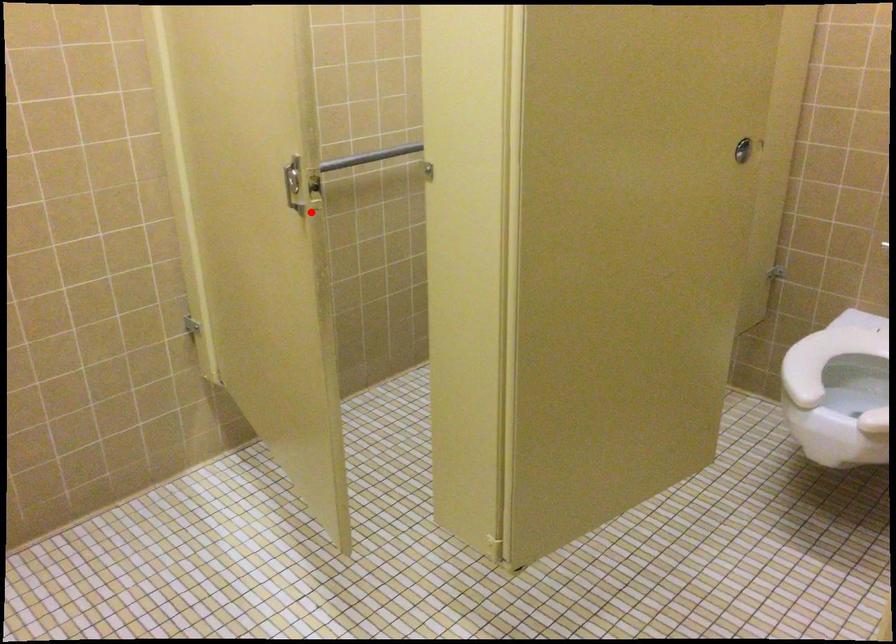
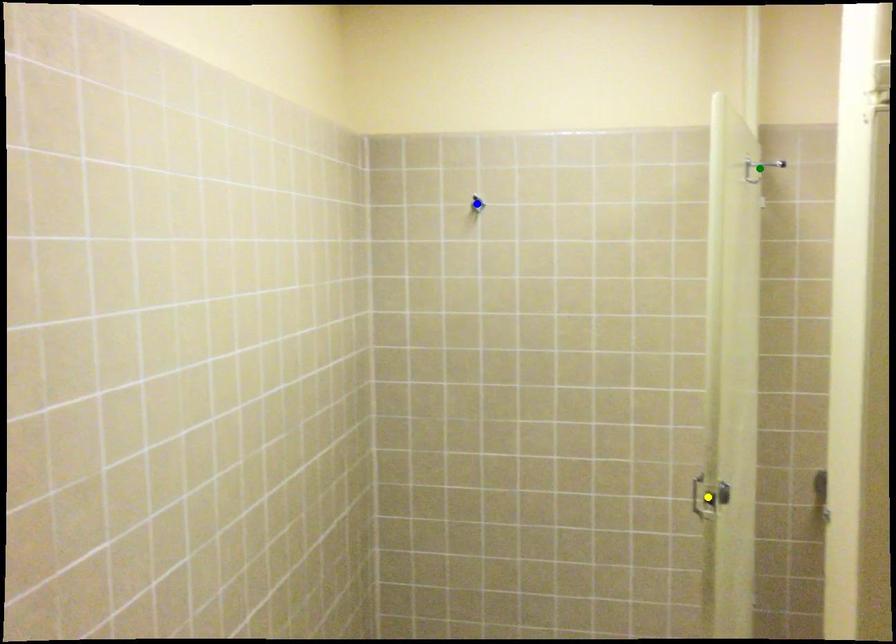
Question: I am providing you with two images of the same scene from different viewpoints. A red point is marked on the first image. You are given multiple points on the second image. Which point in image 2 represents the same 3d spot as the red point in image 1?

Choices:
 (A) green point
 (B) yellow point
 (C) blue point

Answer: (B)